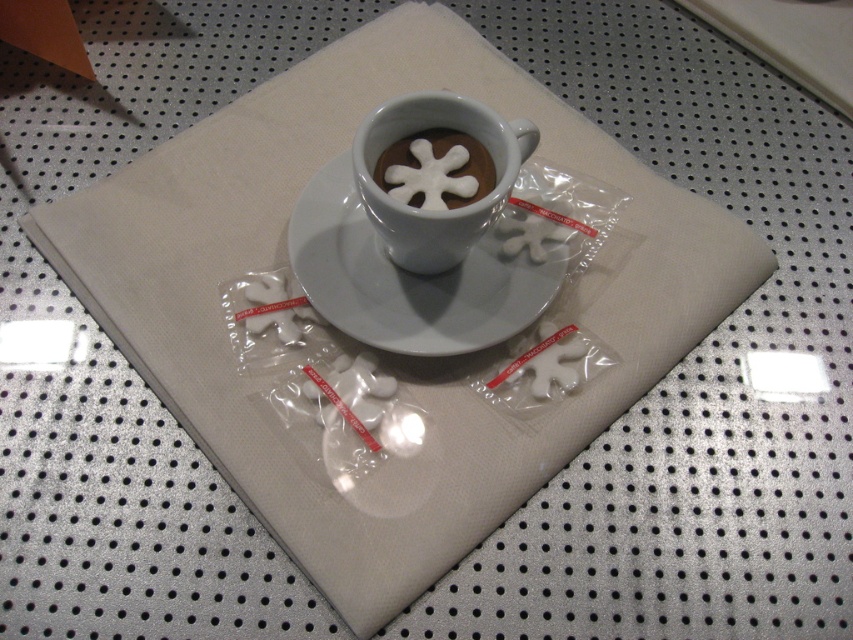
Question: Which of the following is the farthest from the observer?

Choices:
 (A) (347, 241)
 (B) (438, 195)

Answer: (A)

Question: Can you confirm if white glossy saucer at center is positioned below white frothy snowflake at center?

Choices:
 (A) no
 (B) yes

Answer: (B)

Question: Does white glossy saucer at center have a lesser width compared to white frothy snowflake at center?

Choices:
 (A) yes
 (B) no

Answer: (B)

Question: From the image, what is the correct spatial relationship of white glossy saucer at center in relation to white frothy snowflake at center?

Choices:
 (A) below
 (B) above

Answer: (A)